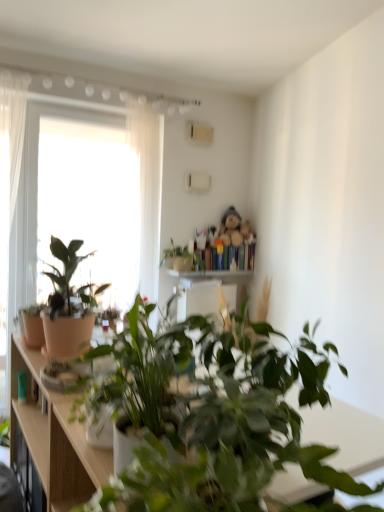
Question: Should I look upward or downward to see wooden bookshelf at upper center?

Choices:
 (A) down
 (B) up

Answer: (A)

Question: From a real-world perspective, is matte brown cabinet at left on top of wooden bookshelf at upper center?

Choices:
 (A) yes
 (B) no

Answer: (B)

Question: Can we say matte brown cabinet at left lies outside wooden bookshelf at upper center?

Choices:
 (A) yes
 (B) no

Answer: (A)

Question: From the image's perspective, does matte brown cabinet at left appear higher than wooden bookshelf at upper center?

Choices:
 (A) yes
 (B) no

Answer: (B)

Question: Is matte brown cabinet at left at the right side of wooden bookshelf at upper center?

Choices:
 (A) no
 (B) yes

Answer: (A)

Question: Does matte brown cabinet at left appear on the left side of wooden bookshelf at upper center?

Choices:
 (A) no
 (B) yes

Answer: (B)

Question: Is matte brown cabinet at left smaller than wooden bookshelf at upper center?

Choices:
 (A) yes
 (B) no

Answer: (B)

Question: Is green leafy plant at center, the third houseplant viewed from the back, bigger than transparent glass window at upper left?

Choices:
 (A) no
 (B) yes

Answer: (A)

Question: Is green leafy plant at center, which is counted as the second houseplant, starting from the front, wider than transparent glass window at upper left?

Choices:
 (A) no
 (B) yes

Answer: (B)

Question: From a real-world perspective, is green leafy plant at center, the third houseplant viewed from the back, over transparent glass window at upper left?

Choices:
 (A) yes
 (B) no

Answer: (B)

Question: From the image's perspective, is green leafy plant at center, the third houseplant viewed from the back, above transparent glass window at upper left?

Choices:
 (A) yes
 (B) no

Answer: (B)

Question: Could transparent glass window at upper left be considered to be inside green leafy plant at center, the third houseplant viewed from the back?

Choices:
 (A) no
 (B) yes

Answer: (A)

Question: Does green leafy plant at center, which is counted as the second houseplant, starting from the front, have a greater height compared to transparent glass window at upper left?

Choices:
 (A) no
 (B) yes

Answer: (A)

Question: Considering the relative sizes of white sheer curtain at upper left and wooden at center in the image provided, is white sheer curtain at upper left shorter than wooden at center?

Choices:
 (A) no
 (B) yes

Answer: (A)